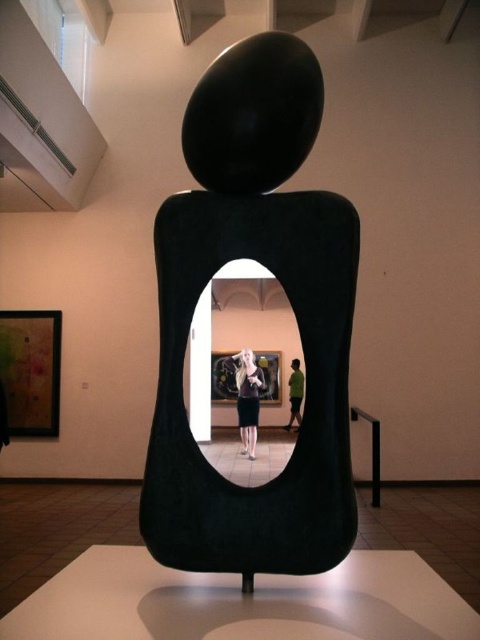
Question: Does smooth black dress at center have a larger size compared to green matte shirt at center?

Choices:
 (A) yes
 (B) no

Answer: (A)

Question: Among these points, which one is nearest to the camera?

Choices:
 (A) (260, 241)
 (B) (252, 369)

Answer: (A)

Question: Which object is the closest to the green matte shirt at center?

Choices:
 (A) black matte sculpture at center
 (B) smooth black dress at center

Answer: (B)

Question: Does smooth black dress at center have a larger size compared to green matte shirt at center?

Choices:
 (A) no
 (B) yes

Answer: (B)

Question: Which object is farther from the camera taking this photo?

Choices:
 (A) black matte sculpture at center
 (B) green matte shirt at center

Answer: (B)

Question: Can you confirm if black matte sculpture at center is positioned to the right of smooth black dress at center?

Choices:
 (A) yes
 (B) no

Answer: (A)